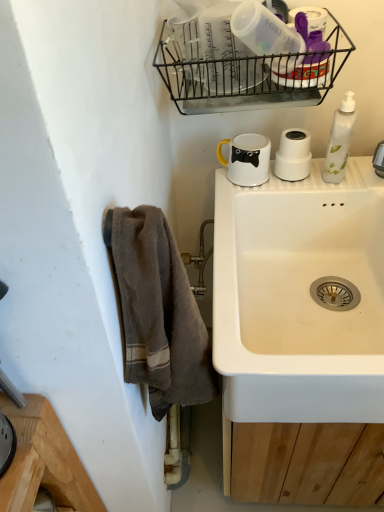
Question: Can you confirm if black wire basket at upper center is taller than white glossy mug at upper right?

Choices:
 (A) no
 (B) yes

Answer: (B)

Question: Is black wire basket at upper center not within white glossy mug at upper right?

Choices:
 (A) no
 (B) yes

Answer: (B)

Question: Is black wire basket at upper center positioned before white glossy mug at upper right?

Choices:
 (A) no
 (B) yes

Answer: (B)

Question: Is black wire basket at upper center thinner than white glossy mug at upper right?

Choices:
 (A) yes
 (B) no

Answer: (B)

Question: Could white glossy mug at upper right be considered to be inside black wire basket at upper center?

Choices:
 (A) no
 (B) yes

Answer: (A)

Question: From a real-world perspective, is white matte cup at upper right, the first appliance in the bottom-to-top sequence, physically located above or below brown textured towel at left?

Choices:
 (A) above
 (B) below

Answer: (A)

Question: Is white matte cup at upper right, arranged as the 2th appliance when viewed from the top, taller or shorter than brown textured towel at left?

Choices:
 (A) tall
 (B) short

Answer: (B)

Question: Would you say white matte cup at upper right, the first appliance in the bottom-to-top sequence, is inside or outside brown textured towel at left?

Choices:
 (A) inside
 (B) outside

Answer: (B)

Question: Is white matte cup at upper right, the 2th appliance from the front, to the left or to the right of brown textured towel at left in the image?

Choices:
 (A) left
 (B) right

Answer: (B)

Question: Which is correct: white ceramic sink at center is inside brown textured towel at left, or outside of it?

Choices:
 (A) inside
 (B) outside

Answer: (B)

Question: From the image's perspective, is white ceramic sink at center above or below brown textured towel at left?

Choices:
 (A) above
 (B) below

Answer: (A)

Question: In terms of size, does white ceramic sink at center appear bigger or smaller than brown textured towel at left?

Choices:
 (A) small
 (B) big

Answer: (B)

Question: From a real-world perspective, is white ceramic sink at center physically located above or below brown textured towel at left?

Choices:
 (A) below
 (B) above

Answer: (A)

Question: Looking at the image, does brown textured towel at left seem bigger or smaller compared to white glossy bottle at right?

Choices:
 (A) small
 (B) big

Answer: (B)

Question: Considering the positions of brown textured towel at left and white glossy bottle at right in the image, is brown textured towel at left taller or shorter than white glossy bottle at right?

Choices:
 (A) tall
 (B) short

Answer: (A)